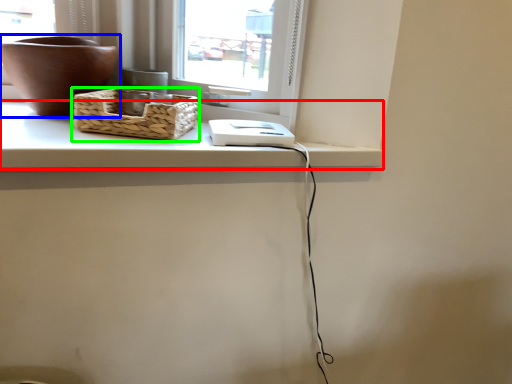
Question: Considering the real-world distances, which object is closest to counter top (highlighted by a red box)? flowerpot (highlighted by a blue box) or picnic basket (highlighted by a green box).

Choices:
 (A) flowerpot
 (B) picnic basket

Answer: (B)